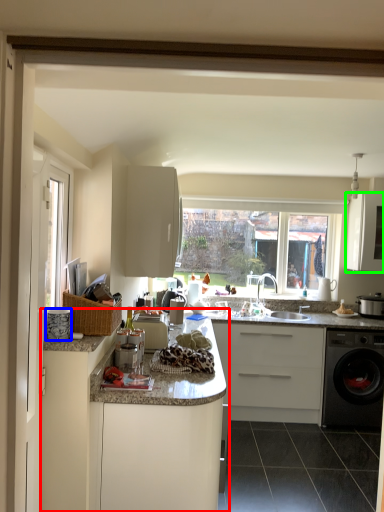
Question: Which object is positioned closest to cabinetry (highlighted by a red box)? Select from appliance (highlighted by a blue box) and cabinetry (highlighted by a green box).

Choices:
 (A) appliance
 (B) cabinetry

Answer: (A)